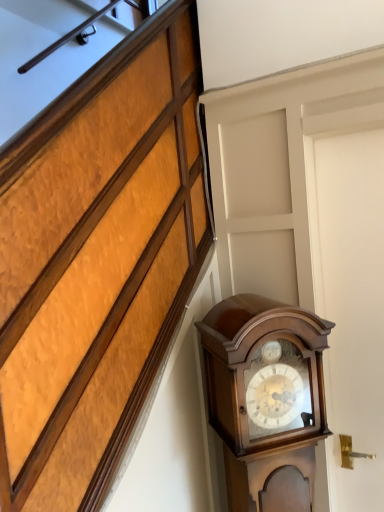
What do you see at coordinates (350, 303) in the screenshot? I see `white matte door at right` at bounding box center [350, 303].

Identify the location of white matte door at right. This screenshot has width=384, height=512. (350, 303).

The image size is (384, 512). What do you see at coordinates (266, 399) in the screenshot? I see `polished wood grandfather clock at right` at bounding box center [266, 399].

Find the location of `polished wood grandfather clock at right`. polished wood grandfather clock at right is located at coordinates (266, 399).

Locate an element on the screen. This screenshot has height=512, width=384. white matte door at right is located at coordinates (350, 303).

Does polished wood grandfather clock at right appear on the right side of white matte door at right?

No.

Is polished wood grandfather clock at right in front of white matte door at right?

Yes, polished wood grandfather clock at right is closer to the viewer.

Is point (270, 451) closer to camera compared to point (370, 316)?

Yes, point (270, 451) is in front of point (370, 316).

From the image's perspective, is polished wood grandfather clock at right on white matte door at right?

No, from the image's perspective, polished wood grandfather clock at right is not over white matte door at right.

From a real-world perspective, which is physically above, polished wood grandfather clock at right or white matte door at right?

From a 3D spatial view, white matte door at right is above.

Considering the sizes of objects polished wood grandfather clock at right and white matte door at right in the image provided, who is thinner, polished wood grandfather clock at right or white matte door at right?

white matte door at right is thinner.

Is polished wood grandfather clock at right taller than white matte door at right?

Incorrect, the height of polished wood grandfather clock at right is not larger of that of white matte door at right.

Which of these two, polished wood grandfather clock at right or white matte door at right, is smaller?

white matte door at right.

Is white matte door at right located within polished wood grandfather clock at right?

No, polished wood grandfather clock at right does not contain white matte door at right.

Would you say polished wood grandfather clock at right is a long distance from white matte door at right?

No, there isn't a large distance between polished wood grandfather clock at right and white matte door at right.

Is polished wood grandfather clock at right facing away from white matte door at right?

polished wood grandfather clock at right does not have its back to white matte door at right.

Can you tell me how much polished wood grandfather clock at right and white matte door at right differ in facing direction?

The angle between the facing direction of polished wood grandfather clock at right and the facing direction of white matte door at right is 44.8 degrees.

This screenshot has height=512, width=384. Identify the location of wall clock on the left of white matte door at right. (266, 399).

Does white matte door at right appear on the right side of polished wood grandfather clock at right?

Indeed, white matte door at right is positioned on the right side of polished wood grandfather clock at right.

Relative to polished wood grandfather clock at right, is white matte door at right in front or behind?

Visually, white matte door at right is located behind polished wood grandfather clock at right.

Which is nearer, (347, 424) or (286, 474)?

Point (347, 424) appears to be farther away from the viewer than point (286, 474).

From the image's perspective, does white matte door at right appear higher than polished wood grandfather clock at right?

Indeed, from the image's perspective, white matte door at right is shown above polished wood grandfather clock at right.

From a real-world perspective, is white matte door at right positioned above or below polished wood grandfather clock at right?

From a real-world perspective, white matte door at right is physically above polished wood grandfather clock at right.

Between white matte door at right and polished wood grandfather clock at right, which one has larger width?

With larger width is polished wood grandfather clock at right.

Considering the sizes of objects white matte door at right and polished wood grandfather clock at right in the image provided, who is taller, white matte door at right or polished wood grandfather clock at right?

With more height is white matte door at right.

Does white matte door at right have a smaller size compared to polished wood grandfather clock at right?

Correct, white matte door at right occupies less space than polished wood grandfather clock at right.

Is polished wood grandfather clock at right surrounded by white matte door at right?

No, polished wood grandfather clock at right is located outside of white matte door at right.

Are white matte door at right and polished wood grandfather clock at right far apart?

No, white matte door at right is not far away from polished wood grandfather clock at right.

Is white matte door at right turned away from polished wood grandfather clock at right?

No.

How many degrees apart are the facing directions of white matte door at right and polished wood grandfather clock at right?

The angular difference between white matte door at right and polished wood grandfather clock at right is 44.8 degrees.

How far apart are white matte door at right and polished wood grandfather clock at right?

white matte door at right is 13.05 inches from polished wood grandfather clock at right.

Image resolution: width=384 pixels, height=512 pixels. What are the coordinates of `door located above the polished wood grandfather clock at right (from a real-world perspective)` in the screenshot? It's located at point(350,303).

At what (x,y) coordinates should I click in order to perform the action: click on wall clock on the left of white matte door at right. Please return your answer as a coordinate pair (x, y). Looking at the image, I should click on (266, 399).

Where is `door on the right of polished wood grandfather clock at right`? The width and height of the screenshot is (384, 512). door on the right of polished wood grandfather clock at right is located at coordinates (350, 303).